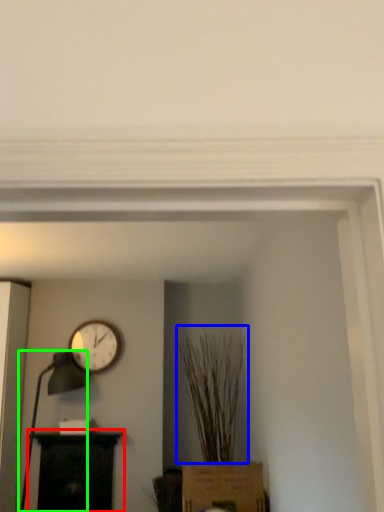
Question: Based on their relative distances, which object is nearer to furniture (highlighted by a red box)? Choose from plant (highlighted by a blue box) and table lamp (highlighted by a green box).

Choices:
 (A) plant
 (B) table lamp

Answer: (B)